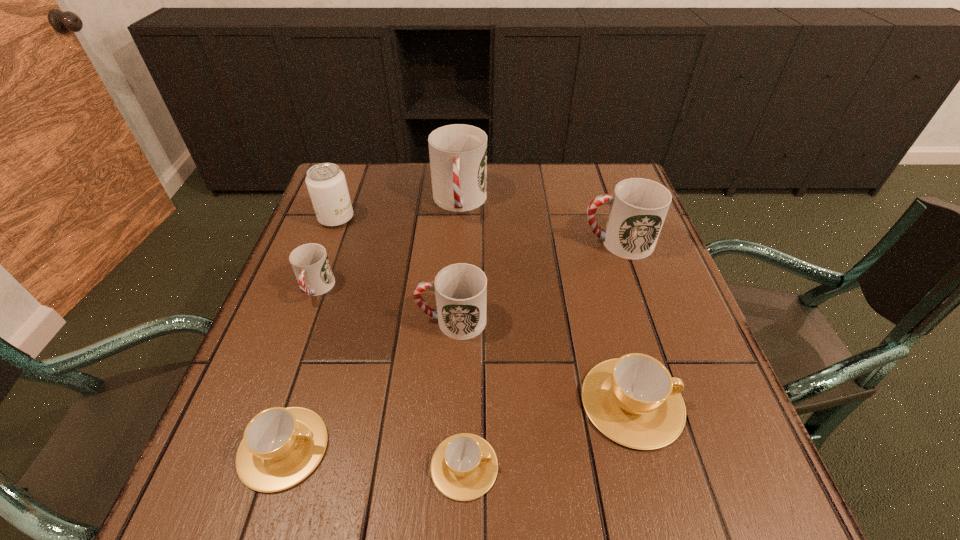
I want to click on blank area located on the side of the fourth tallest object where the handle is located, so click(355, 321).

The image size is (960, 540). Identify the location of vacant point located on the side of the leftmost red cup where the handle is located. (247, 480).

The width and height of the screenshot is (960, 540). Identify the location of vacant area located with the handle on the side of the rightmost brown cup. (710, 402).

Find the location of a particular element. The width and height of the screenshot is (960, 540). vacant space located with the handle on the side of the leftmost brown cup is located at coordinates (x=399, y=448).

The height and width of the screenshot is (540, 960). Identify the location of vacant region located with the handle on the side of the shortest object. (548, 466).

This screenshot has width=960, height=540. Identify the location of cup that is at the far edge. (458, 153).

This screenshot has height=540, width=960. I want to click on soda can present at the far edge, so click(326, 183).

Identify the location of soda can present at the left edge. (326, 183).

At what (x,y) coordinates should I click in order to perform the action: click on object that is at the far left corner. Please return your answer as a coordinate pair (x, y). The height and width of the screenshot is (540, 960). Looking at the image, I should click on (326, 183).

This screenshot has width=960, height=540. What are the coordinates of `object present at the near left corner` in the screenshot? It's located at (281, 446).